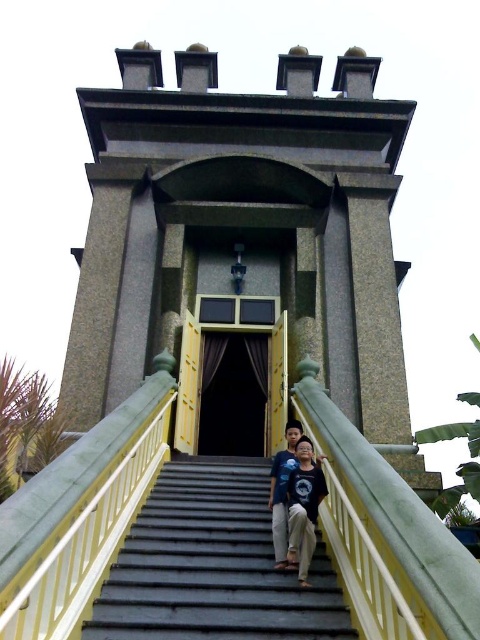
Consider the image. You are standing at the entrance of the grand temple and want to take a photo of the smooth concrete stairs at center. Which direction should you face to capture them in your shot?

The smooth concrete stairs at center are located at point coordinates, so you should face towards the center area to capture them in your photo.

You are standing at the base of the temple structure and want to reach the entrance. There are two points marked on the stairs leading up to the door. Which point, point (253, 474) or point (282, 486), is closer to you?

Point (253, 474) is closer to you because it is further to the viewer than point (282, 486), meaning it is physically nearer in the spatial arrangement.

From the picture: You are standing at the base of the temple structure and notice both the smooth concrete stairs at center and the blue denim shirt at center. Which object is shorter in height?

The smooth concrete stairs at center is shorter in height compared to the blue denim shirt at center.